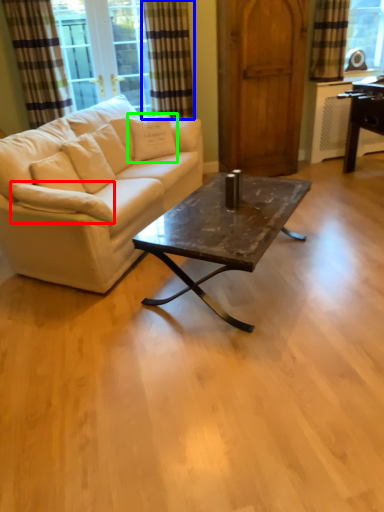
Question: Which is farther away from pillow (highlighted by a red box)? curtain (highlighted by a blue box) or pillow (highlighted by a green box)?

Choices:
 (A) curtain
 (B) pillow

Answer: (A)